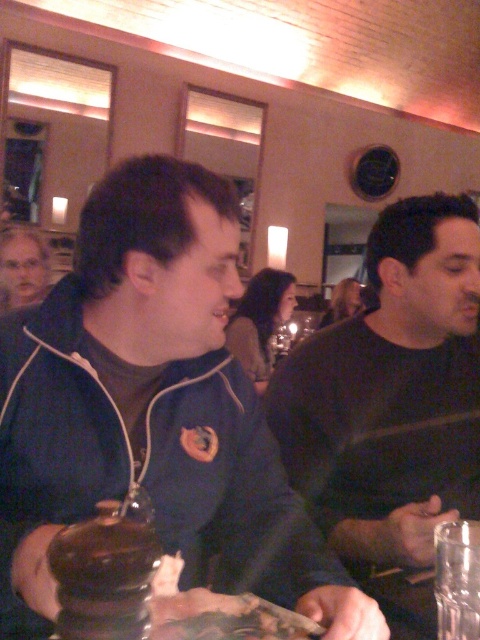
Question: Which point is closer to the camera?

Choices:
 (A) (411, 378)
 (B) (41, 611)

Answer: (B)

Question: Estimate the real-world distances between objects in this image. Which object is closer to the transparent glass jar at lower right?

Choices:
 (A) blue fleece jacket at center
 (B) dark gray shirt at center
 (C) gray hair at upper left

Answer: (A)

Question: Is blue fleece jacket at center positioned behind dark gray shirt at center?

Choices:
 (A) yes
 (B) no

Answer: (B)

Question: Does blue fleece jacket at center have a smaller size compared to gray hair at upper left?

Choices:
 (A) yes
 (B) no

Answer: (B)

Question: Estimate the real-world distances between objects in this image. Which object is closer to the blue fleece jacket at center?

Choices:
 (A) dark gray shirt at center
 (B) transparent glass jar at lower right

Answer: (A)

Question: Considering the relative positions of blue fleece jacket at center and gray hair at upper left in the image provided, where is blue fleece jacket at center located with respect to gray hair at upper left?

Choices:
 (A) right
 (B) left

Answer: (A)